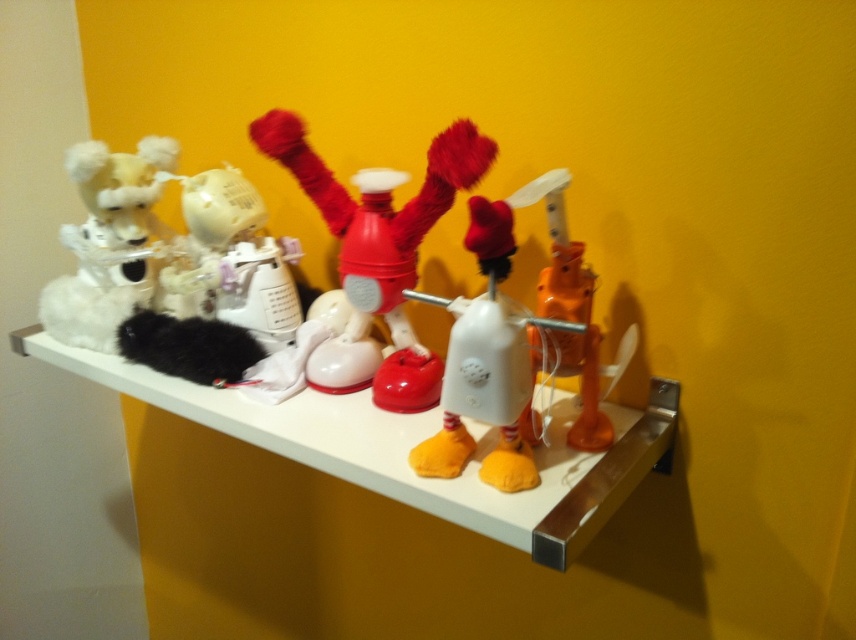
Which is above, fluffy white toy at left or orange matte robot at center?

Positioned higher is fluffy white toy at left.

Can you confirm if fluffy white toy at left is positioned below orange matte robot at center?

No, fluffy white toy at left is not below orange matte robot at center.

Which is behind, point (105, 243) or point (593, 392)?

The point (105, 243) is behind.

This screenshot has height=640, width=856. What are the coordinates of `fluffy white toy at left` in the screenshot? It's located at (107, 241).

From the picture: Can you confirm if white matte toy phone at center is positioned to the right of orange matte robot at center?

Incorrect, white matte toy phone at center is not on the right side of orange matte robot at center.

Who is positioned more to the right, white matte toy phone at center or orange matte robot at center?

Positioned to the right is orange matte robot at center.

Find the location of a particular element. white matte toy phone at center is located at coordinates (484, 368).

Which is more to the right, rubberized red robot at center or orange matte robot at center?

orange matte robot at center is more to the right.

Is rubberized red robot at center to the left of orange matte robot at center from the viewer's perspective?

Indeed, rubberized red robot at center is positioned on the left side of orange matte robot at center.

You are a GUI agent. You are given a task and a screenshot of the screen. Output one action in this format:
    pyautogui.click(x=<x>, y=<y>)
    Task: Click on the rubberized red robot at center
    
    Given the screenshot: What is the action you would take?
    click(378, 212)

I want to click on rubberized red robot at center, so click(x=378, y=212).